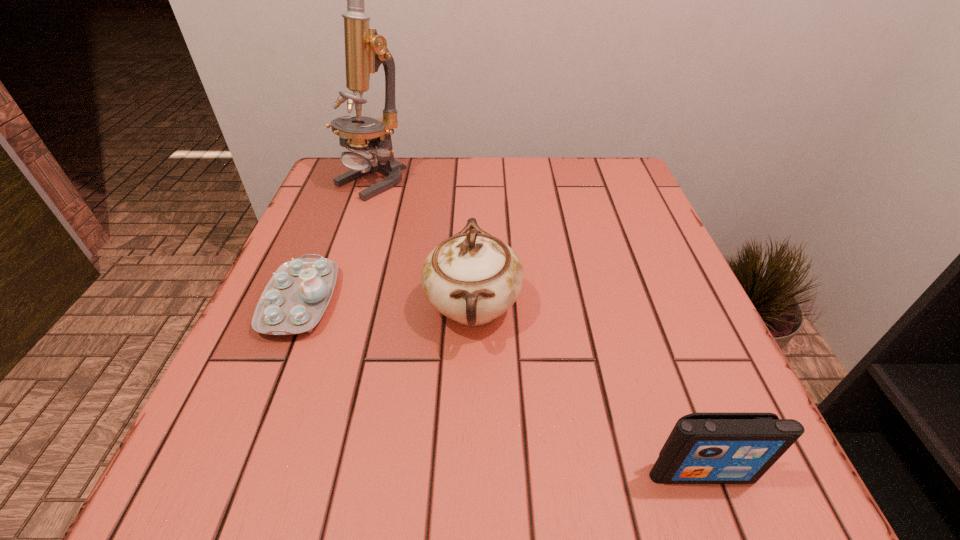
Where is `free space located on the right of the shortest object`? The height and width of the screenshot is (540, 960). free space located on the right of the shortest object is located at coordinates (401, 301).

Locate an element on the screen. object present at the far edge is located at coordinates click(x=365, y=50).

Image resolution: width=960 pixels, height=540 pixels. I want to click on object at the near edge, so click(x=703, y=448).

The height and width of the screenshot is (540, 960). I want to click on microscope that is at the left edge, so click(365, 50).

Find the location of a particular element. This screenshot has height=540, width=960. chinaware situated at the left edge is located at coordinates tap(294, 300).

Find the location of a particular element. This screenshot has height=540, width=960. object that is at the right edge is located at coordinates (703, 448).

The width and height of the screenshot is (960, 540). Find the location of `object present at the far left corner`. object present at the far left corner is located at coordinates (365, 50).

Identify the location of object present at the near right corner. The height and width of the screenshot is (540, 960). (703, 448).

Identify the location of vacant space at the far edge. (538, 175).

Locate an element on the screen. This screenshot has width=960, height=540. vacant space at the near edge of the desktop is located at coordinates (646, 453).